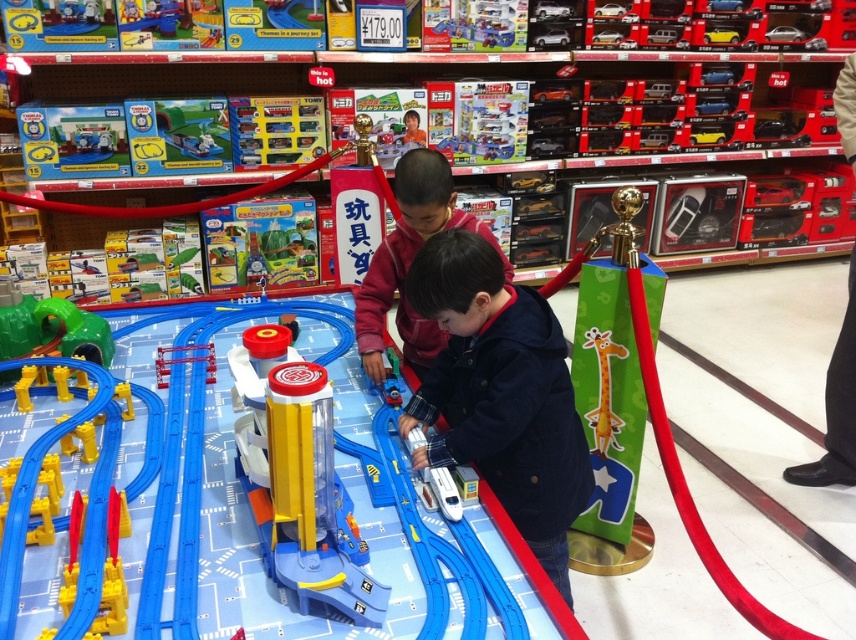
Between dark blue jacket at center and green plastic tunnel at lower left, which one appears on the right side from the viewer's perspective?

Positioned to the right is dark blue jacket at center.

Locate an element on the screen. This screenshot has height=640, width=856. dark blue jacket at center is located at coordinates (500, 394).

Who is taller, translucent plastic track at center or green plastic tunnel at lower left?

translucent plastic track at center

You are a GUI agent. You are given a task and a screenshot of the screen. Output one action in this format:
    pyautogui.click(x=<x>, y=<y>)
    Task: Click on the translucent plastic track at center
    The width and height of the screenshot is (856, 640).
    Given the screenshot: What is the action you would take?
    click(x=298, y=476)

This screenshot has height=640, width=856. What are the coordinates of `translucent plastic track at center` in the screenshot? It's located at (298, 476).

Does dark blue jacket at center appear on the right side of translucent plastic track at center?

Indeed, dark blue jacket at center is positioned on the right side of translucent plastic track at center.

Between dark blue jacket at center and translucent plastic track at center, which one has more height?

Standing taller between the two is dark blue jacket at center.

The height and width of the screenshot is (640, 856). I want to click on dark blue jacket at center, so click(500, 394).